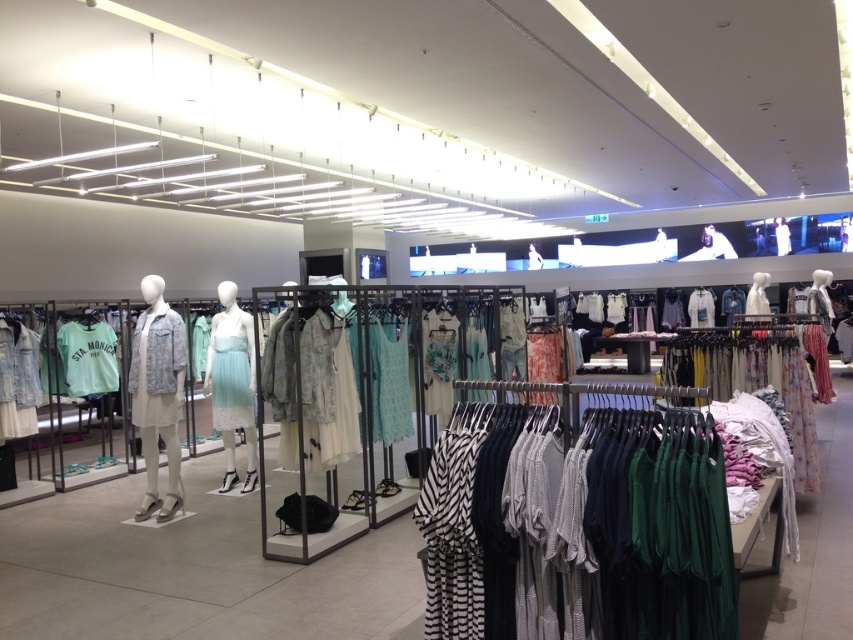
Question: Is matte white dress at center closer to the viewer compared to floral-patterned fabric jacket at center?

Choices:
 (A) yes
 (B) no

Answer: (B)

Question: Among these points, which one is farthest from the camera?

Choices:
 (A) (715, 570)
 (B) (209, 349)

Answer: (B)

Question: Which of the following is the closest to the observer?

Choices:
 (A) (756, 317)
 (B) (146, 412)
 (C) (685, 504)

Answer: (C)

Question: Can you confirm if green jersey dress at center is positioned below matte white dress at center?

Choices:
 (A) no
 (B) yes

Answer: (A)

Question: Can you confirm if floral-patterned fabric jacket at center is positioned to the right of mint fabric dress at center?

Choices:
 (A) yes
 (B) no

Answer: (B)

Question: Which of the following is the closest to the observer?

Choices:
 (A) (137, 518)
 (B) (242, 339)
 (C) (154, 333)

Answer: (C)